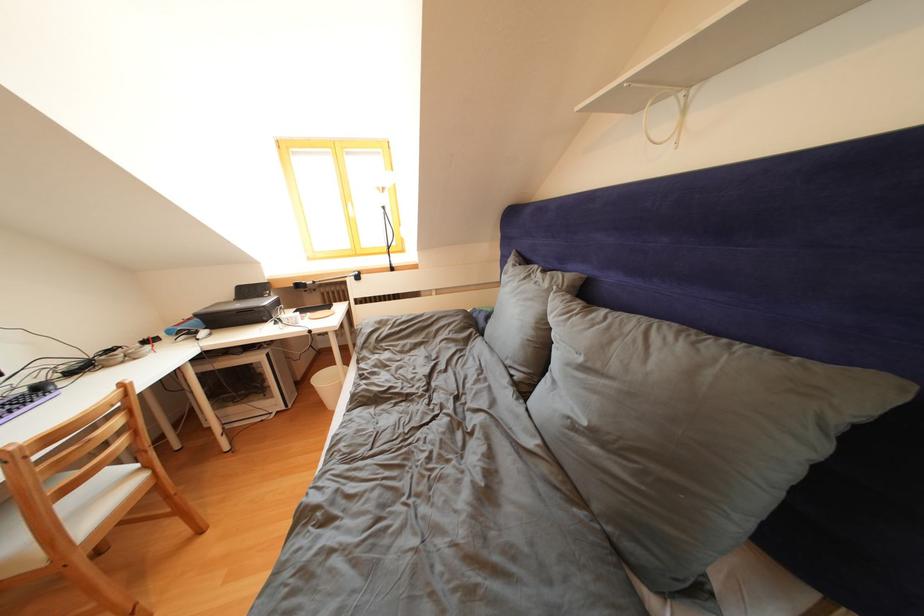
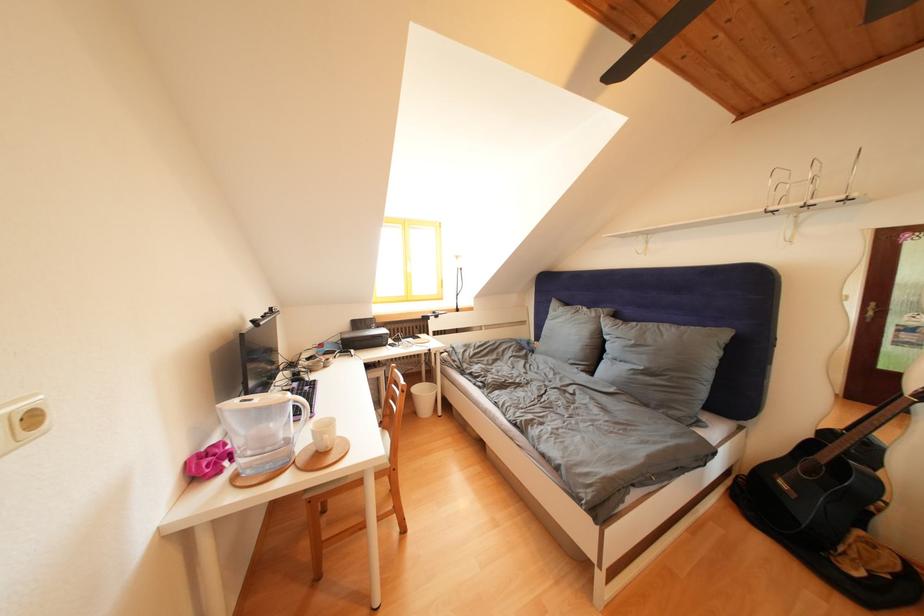
Locate, in the second image, the point that corresponds to (x=553, y=290) in the first image.

(602, 320)